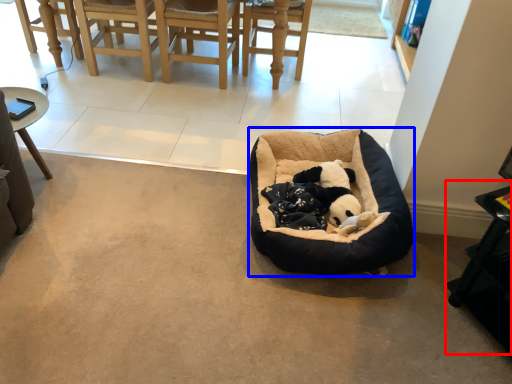
Question: Among these objects, which one is farthest to the camera, table (highlighted by a red box) or dog bed (highlighted by a blue box)?

Choices:
 (A) table
 (B) dog bed

Answer: (B)